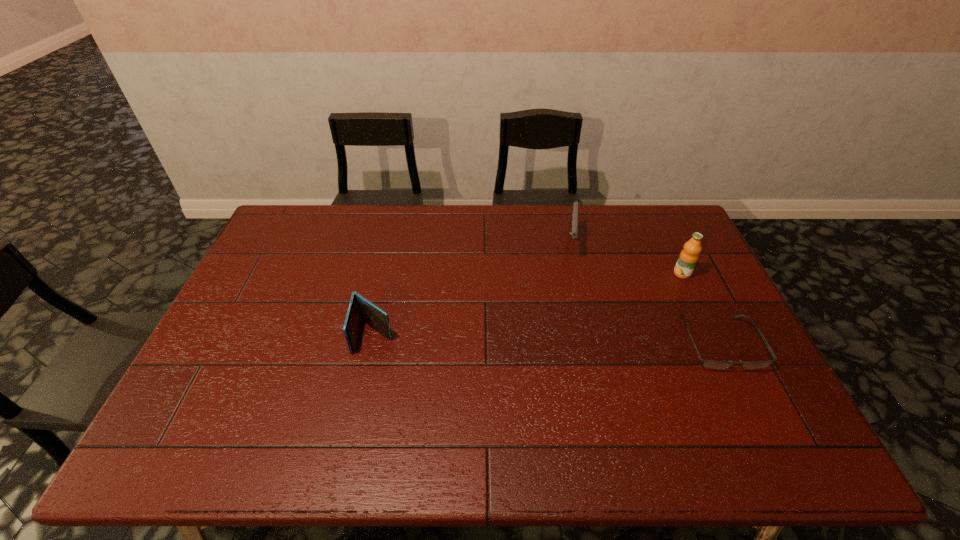
Locate an element on the screen. vacant region located 0.320m on the label of the orange juice is located at coordinates (597, 313).

Where is `vacant point located at the barrel of the pistol`? Image resolution: width=960 pixels, height=540 pixels. vacant point located at the barrel of the pistol is located at coordinates (573, 280).

The width and height of the screenshot is (960, 540). Find the location of `free region located 0.270m at the barrel of the pistol`. free region located 0.270m at the barrel of the pistol is located at coordinates (571, 323).

At what (x,y) coordinates should I click in order to perform the action: click on free space located at the barrel of the pistol. Please return your answer as a coordinate pair (x, y). Looking at the image, I should click on (569, 360).

Find the location of a particular element. The height and width of the screenshot is (540, 960). object at the far edge is located at coordinates (573, 227).

Find the location of a particular element. spectacles that is positioned at the right edge is located at coordinates (709, 364).

This screenshot has height=540, width=960. Identify the location of orange juice located at the right edge. (688, 258).

This screenshot has height=540, width=960. In order to click on vacant area at the far edge in this screenshot , I will do `click(520, 244)`.

Identify the location of free space at the near edge. This screenshot has height=540, width=960. (483, 401).

Locate an element on the screen. vacant space at the left edge of the desktop is located at coordinates click(x=227, y=383).